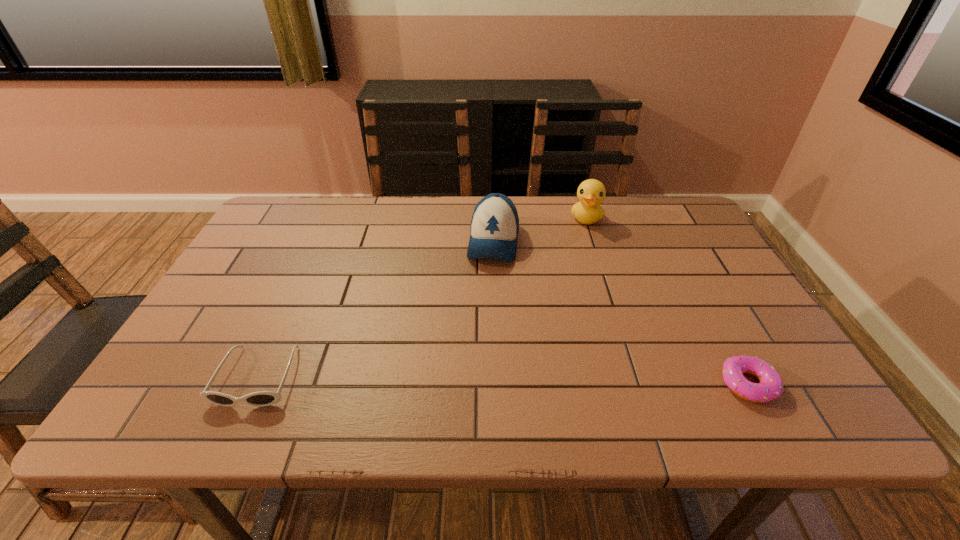
At what (x,y) coordinates should I click in order to perform the action: click on the second shortest object. Please return your answer as a coordinate pair (x, y). Looking at the image, I should click on (262, 398).

At what (x,y) coordinates should I click in order to perform the action: click on the leftmost object. Please return your answer as a coordinate pair (x, y). Looking at the image, I should click on (262, 398).

The width and height of the screenshot is (960, 540). What are the coordinates of `doughnut` in the screenshot? It's located at (771, 386).

Identify the location of the shortest object. (771, 386).

Find the location of `the third object from right to left`. the third object from right to left is located at coordinates [494, 229].

Locate an element on the screen. This screenshot has height=540, width=960. duck is located at coordinates (591, 192).

Where is `vacant space located 0.250m on the back of the shortest object`? vacant space located 0.250m on the back of the shortest object is located at coordinates (694, 285).

Find the location of `free space located on the front-facing side of the second object from left to right`. free space located on the front-facing side of the second object from left to right is located at coordinates (481, 336).

This screenshot has width=960, height=540. I want to click on vacant region located 0.100m on the front-facing side of the second object from left to right, so click(x=488, y=294).

Find the location of a particular element. vacant region located on the front-facing side of the second object from left to right is located at coordinates (478, 357).